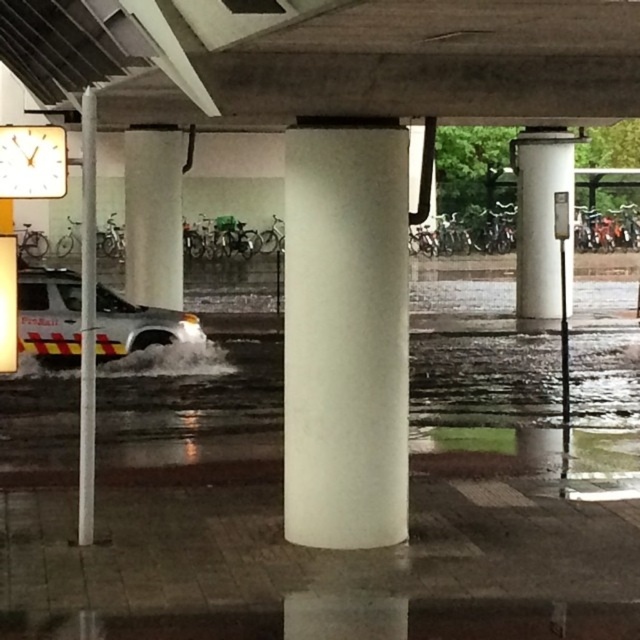
You are a pedestrian trying to cross under the bridge. There is a concrete at center and a white smooth column at center. Which one is above the other?

The concrete at center is positioned over the white smooth column at center, so the concrete is above the column.

You are a delivery person needing to pass under the bridge. There is a white smooth column at center and a white glossy van at lower left. Which object is closer to your right side as you face the bridge?

The white smooth column at center is to the right of the white glossy van at lower left, so when facing the bridge, the white smooth column at center will be closer to your right side.

You are standing at the base of the large concrete structure and want to reach a point located at coordinates point [628,1]. If your maximum comfortable walking distance is 3 meters, can you comfortably walk to that point without needing to rest?

The distance of point [628,1] from viewer is 3.24 meters, which exceeds your maximum comfortable walking distance of 3 meters. Therefore, you may need to rest before reaching the point.